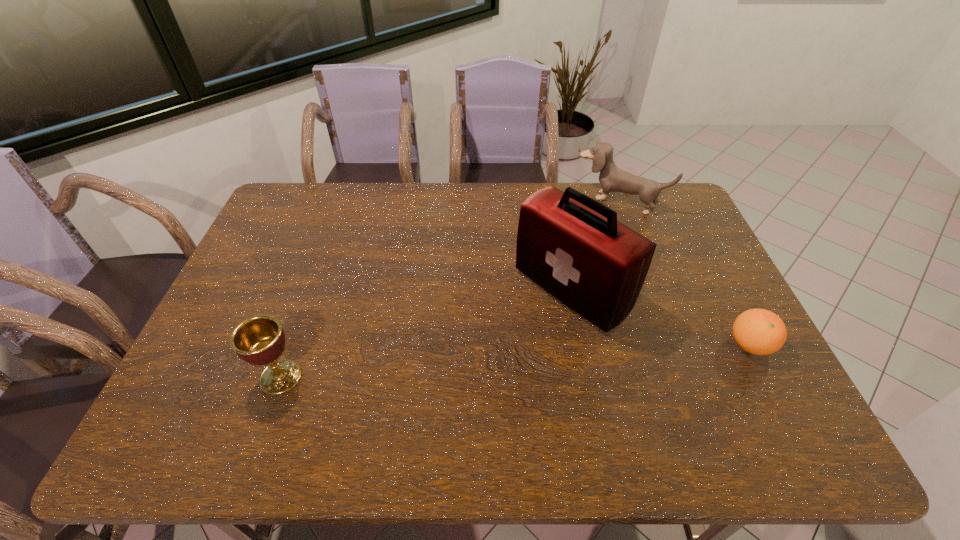
Locate an element on the screen. vacant position located at the face of the farthest object is located at coordinates (580, 246).

In order to click on free point located 0.400m at the face of the farthest object in this screenshot , I will do `click(553, 286)`.

Where is `object that is at the far edge`? object that is at the far edge is located at coordinates (612, 179).

At what (x,y) coordinates should I click in order to perform the action: click on object that is at the near edge. Please return your answer as a coordinate pair (x, y). The width and height of the screenshot is (960, 540). Looking at the image, I should click on (259, 340).

The image size is (960, 540). Identify the location of orange that is at the right edge. (758, 331).

At what (x,y) coordinates should I click in order to perform the action: click on puppy positioned at the right edge. Please return your answer as a coordinate pair (x, y). Looking at the image, I should click on (612, 179).

Where is `object present at the far right corner`? The width and height of the screenshot is (960, 540). object present at the far right corner is located at coordinates (612, 179).

Locate an element on the screen. Image resolution: width=960 pixels, height=540 pixels. vacant space at the far edge of the desktop is located at coordinates (376, 211).

This screenshot has width=960, height=540. Find the location of `free space at the near edge`. free space at the near edge is located at coordinates (560, 404).

At what (x,y) coordinates should I click in order to perform the action: click on vacant space at the left edge of the desktop. Please return your answer as a coordinate pair (x, y). Looking at the image, I should click on (210, 342).